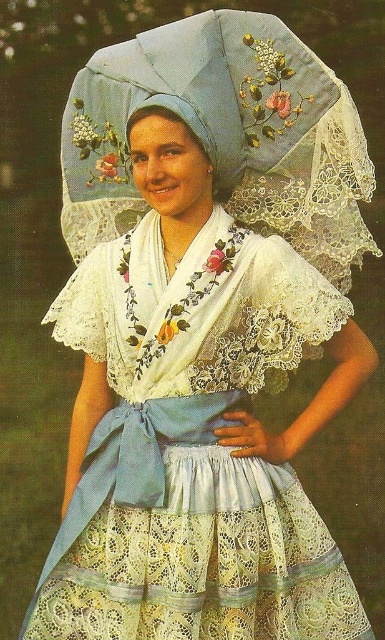
Question: Is lace fabric umbrella at upper center positioned in front of light blue lace headdress at center?

Choices:
 (A) no
 (B) yes

Answer: (A)

Question: Is lace fabric umbrella at upper center smaller than light blue lace headdress at center?

Choices:
 (A) no
 (B) yes

Answer: (A)

Question: Is the position of lace fabric umbrella at upper center more distant than that of light blue lace headdress at center?

Choices:
 (A) no
 (B) yes

Answer: (B)

Question: Which point is farther from the camera taking this photo?

Choices:
 (A) (254, 67)
 (B) (195, 112)

Answer: (A)

Question: Among these points, which one is nearest to the camera?

Choices:
 (A) (x=279, y=176)
 (B) (x=138, y=113)

Answer: (B)